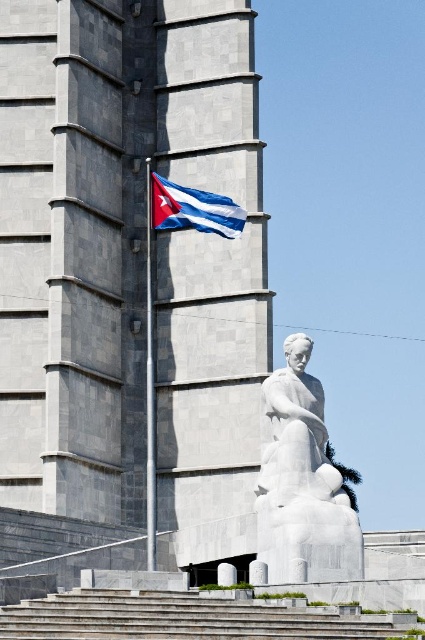
Can you confirm if smooth concrete tower at center is smaller than white marble statue at center?

No.

Is smooth concrete tower at center below white marble statue at center?

No, smooth concrete tower at center is not below white marble statue at center.

What do you see at coordinates (129, 280) in the screenshot? I see `smooth concrete tower at center` at bounding box center [129, 280].

Locate an element on the screen. smooth concrete tower at center is located at coordinates (129, 280).

Describe the element at coordinates (129, 280) in the screenshot. I see `smooth concrete tower at center` at that location.

Looking at this image, between smooth concrete tower at center and gray concrete stairs at lower center, which one appears on the left side from the viewer's perspective?

From the viewer's perspective, smooth concrete tower at center appears more on the left side.

Where is `smooth concrete tower at center`? smooth concrete tower at center is located at coordinates (129, 280).

Can you confirm if gray concrete stairs at lower center is smaller than blue and white striped fabric at upper center?

Indeed, gray concrete stairs at lower center has a smaller size compared to blue and white striped fabric at upper center.

Who is higher up, gray concrete stairs at lower center or blue and white striped fabric at upper center?

blue and white striped fabric at upper center

Does point (115, 611) come behind point (184, 221)?

No, it is not.

Where is `gray concrete stairs at lower center`? gray concrete stairs at lower center is located at coordinates (192, 618).